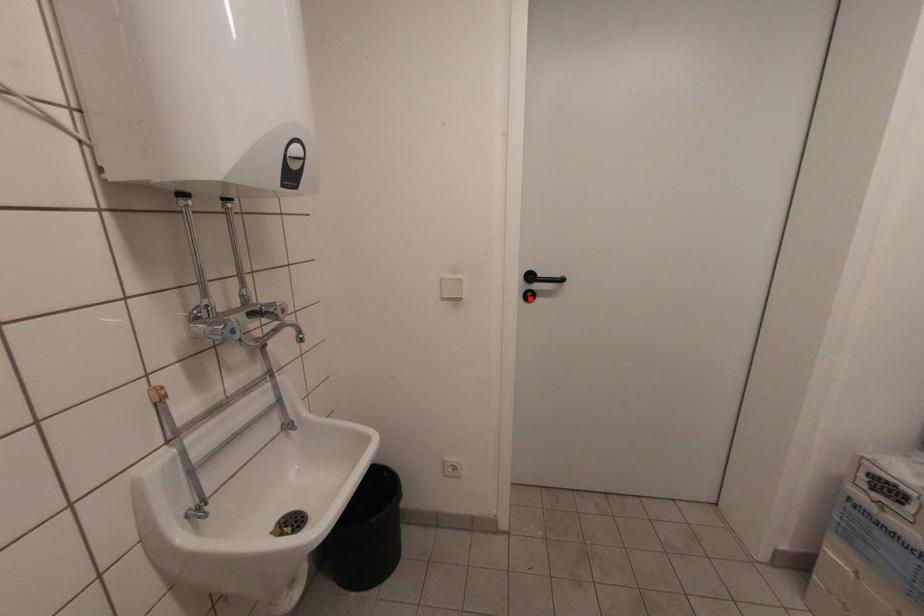
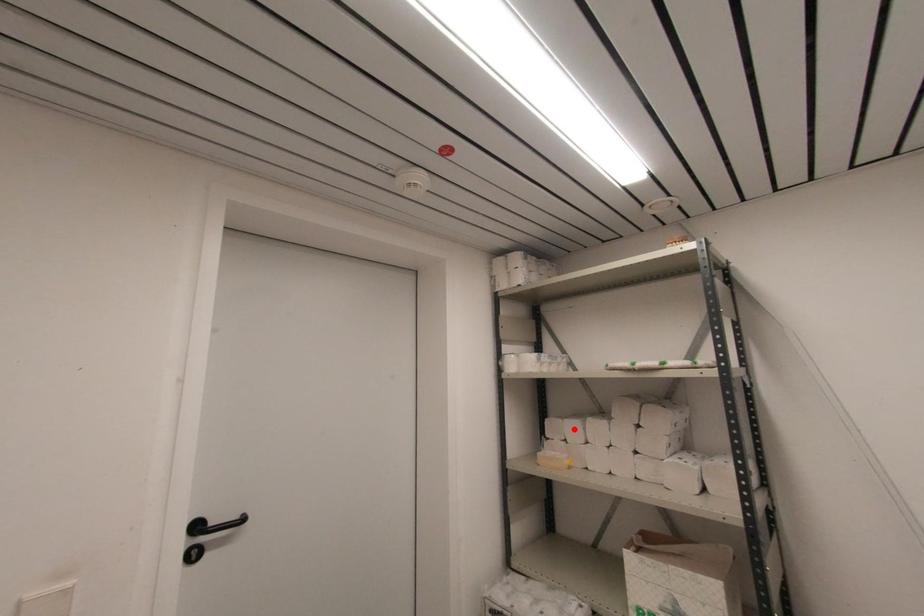
I am providing you with two images of the same scene from different viewpoints. A red point is marked on the first image and another point is marked on the second image. Is the red point in image1 aligned with the point shown in image2?

No